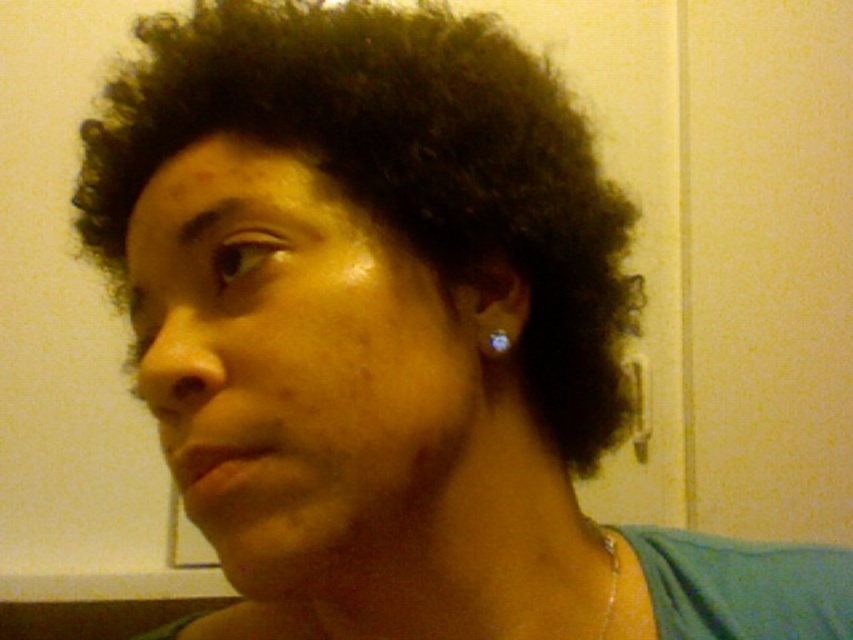
Question: Which object appears farthest from the camera in this image?

Choices:
 (A) gold metallic necklace at lower center
 (B) dark curly hair at center

Answer: (A)

Question: Is dark curly hair at center above gold metallic necklace at lower center?

Choices:
 (A) yes
 (B) no

Answer: (A)

Question: Which point appears farthest from the camera in this image?

Choices:
 (A) (613, 618)
 (B) (506, 340)
 (C) (448, 72)

Answer: (A)

Question: Does dark curly hair at center have a lesser width compared to gold metallic necklace at lower center?

Choices:
 (A) yes
 (B) no

Answer: (B)

Question: Is dark curly hair at center to the left of silver metallic earring at ear from the viewer's perspective?

Choices:
 (A) yes
 (B) no

Answer: (A)

Question: Which object is positioned closest to the silver metallic earring at ear?

Choices:
 (A) dark curly hair at center
 (B) gold metallic necklace at lower center

Answer: (A)